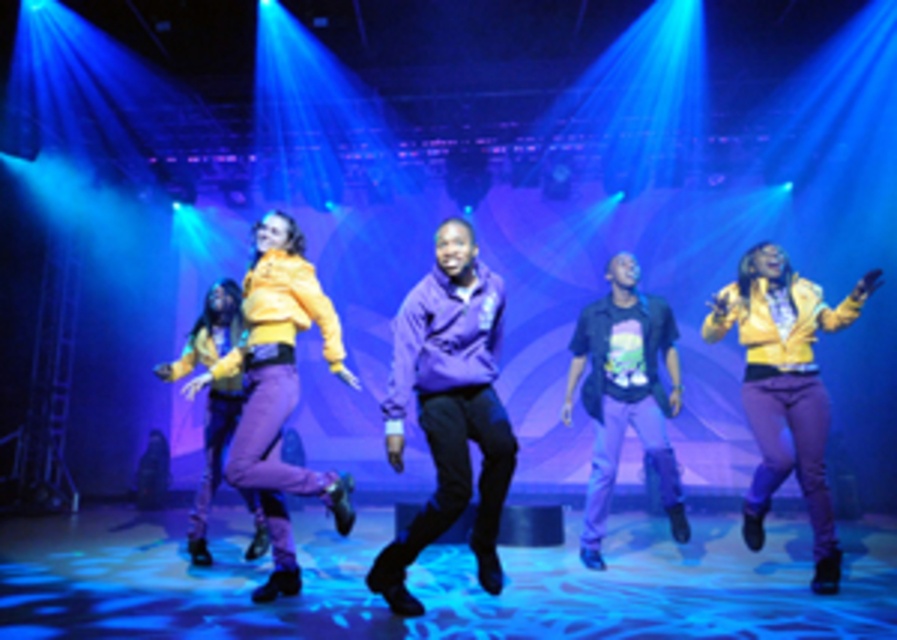
You are a stagehand standing at the edge of the stage. You need to hand a microphone to the performer wearing the purple matte hoodie at center and then to the performer wearing the black matte shirt at center. Given that the microphone cord is 5 feet long, will you be able to reach both performers without moving?

The purple matte hoodie at center is 5.43 feet away from the black matte shirt at center. Since the microphone cord is only 5 feet long, the distance between them is greater than the cord length. Therefore, you cannot reach both performers without moving.